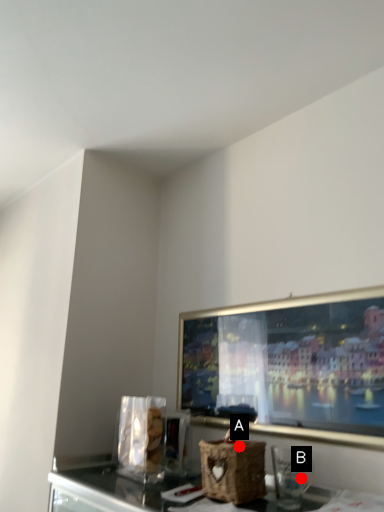
Question: Two points are circled on the image, labeled by A and B beside each circle. Which point appears closest to the camera in this image?

Choices:
 (A) A is closer
 (B) B is closer

Answer: (A)